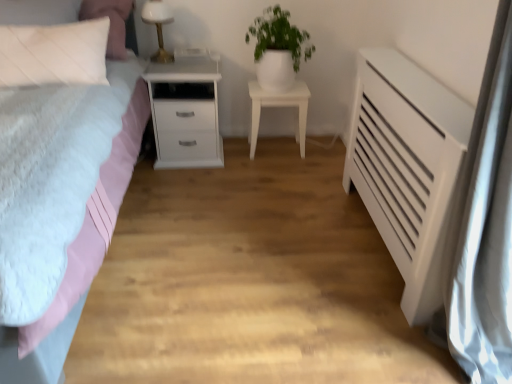
Find the location of a particular element. This screenshot has width=512, height=384. vacant region in front of white glossy table lamp at upper center is located at coordinates (166, 67).